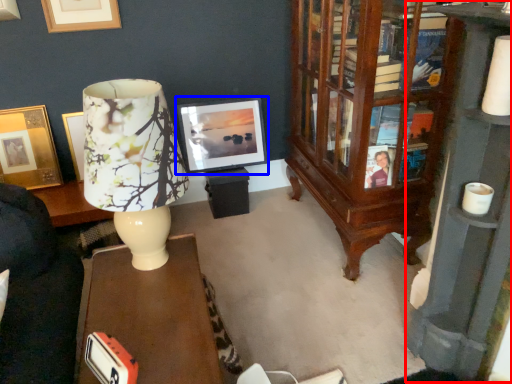
Question: Which point is further to the camera, bookcase (highlighted by a red box) or picture frame (highlighted by a blue box)?

Choices:
 (A) bookcase
 (B) picture frame

Answer: (B)